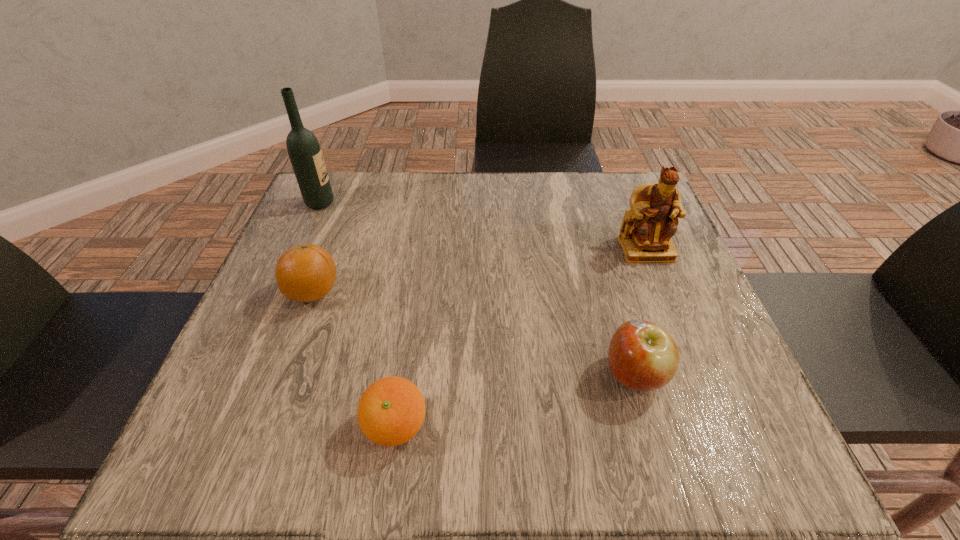
I want to click on vacant space that's between the left orange and the nearer orange, so [x=355, y=359].

This screenshot has height=540, width=960. In order to click on vacant area that lies between the apple and the right orange in this screenshot , I will do `click(516, 401)`.

Where is `free space that is in between the farther orange and the nearer orange`? This screenshot has height=540, width=960. free space that is in between the farther orange and the nearer orange is located at coordinates (355, 359).

Where is `unoccupied area between the tallest object and the fourth shortest object`? The image size is (960, 540). unoccupied area between the tallest object and the fourth shortest object is located at coordinates (483, 226).

Where is `free space between the figurine and the third nearest object`? This screenshot has height=540, width=960. free space between the figurine and the third nearest object is located at coordinates (480, 271).

Locate an element on the screen. This screenshot has width=960, height=540. vacant area between the farther orange and the shorter orange is located at coordinates (355, 359).

Point out which object is positioned as the third nearest to the third nearest object. Please provide its 2D coordinates. Your answer should be formatted as a tuple, i.e. [(x, y)], where the tuple contains the x and y coordinates of a point satisfying the conditions above.

[(643, 356)]

Image resolution: width=960 pixels, height=540 pixels. I want to click on object that is the fourth nearest to the left orange, so click(x=645, y=235).

You are a GUI agent. You are given a task and a screenshot of the screen. Output one action in this format:
    pyautogui.click(x=<x>, y=<y>)
    Task: Click on the free space that satisfies the following two spatial constraints: 1. on the labeled side of the nearer orange; 2. on the right side of the wine bottle
    This screenshot has height=540, width=960.
    Given the screenshot: What is the action you would take?
    pyautogui.click(x=224, y=426)